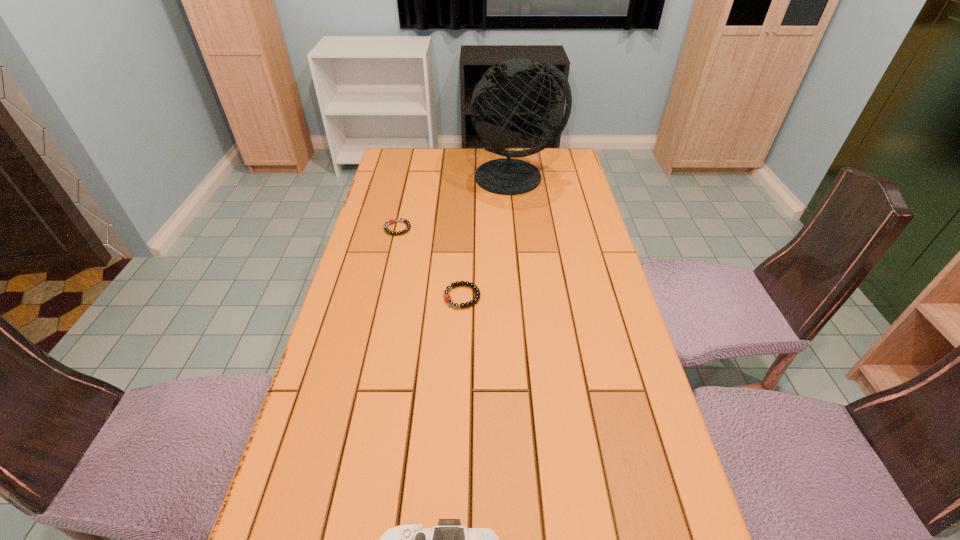
Locate an element on the screen. The width and height of the screenshot is (960, 540). object located at the left edge is located at coordinates (391, 221).

This screenshot has width=960, height=540. I want to click on object that is at the right edge, so click(x=496, y=94).

Locate an element on the screen. The height and width of the screenshot is (540, 960). object at the far right corner is located at coordinates (496, 94).

The width and height of the screenshot is (960, 540). In the image, there is a desktop. Identify the location of vacant space at the far edge. (492, 158).

In the image, there is a desktop. Identify the location of free space at the left edge. The image size is (960, 540). (393, 334).

This screenshot has height=540, width=960. In the image, there is a desktop. What are the coordinates of `vacant space at the right edge` in the screenshot? It's located at (590, 330).

I want to click on free space at the far left corner, so click(x=423, y=153).

Find the location of `free space between the shortest object and the globe`. free space between the shortest object and the globe is located at coordinates (457, 203).

Where is `blank region between the leftmost object and the nearer bracelet`? blank region between the leftmost object and the nearer bracelet is located at coordinates (430, 262).

Image resolution: width=960 pixels, height=540 pixels. What are the coordinates of `free space between the farthest object and the nearer bracelet` in the screenshot? It's located at point(490,237).